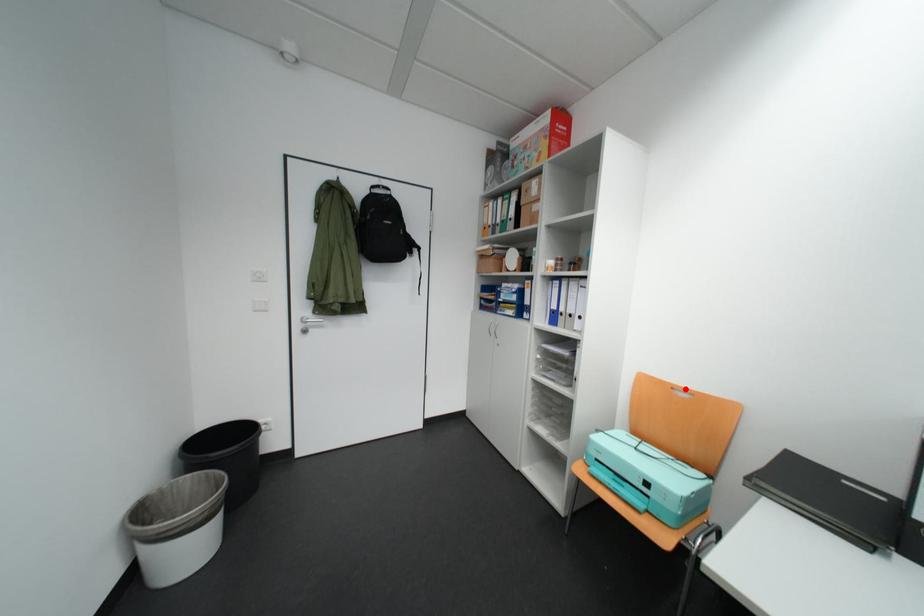
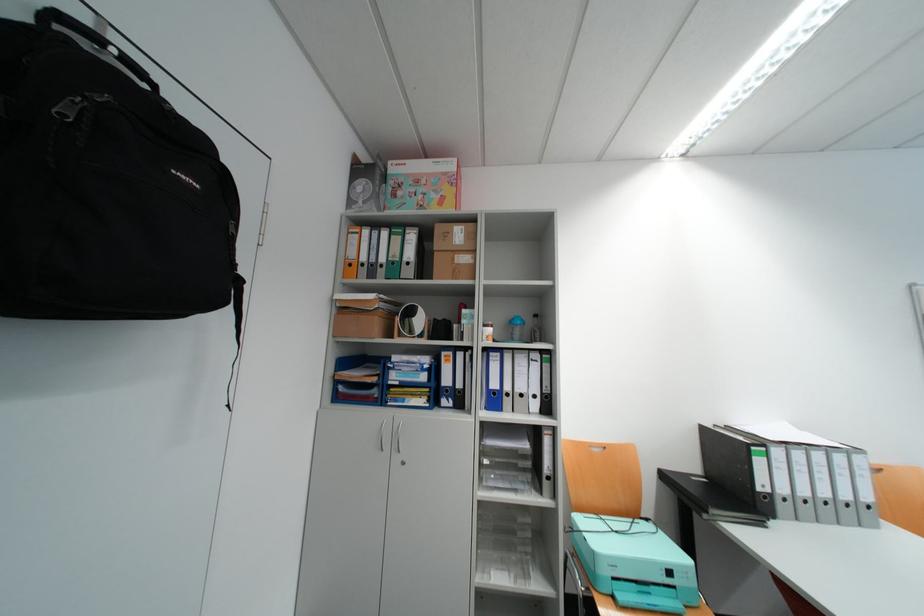
The point at the highlighted location is marked in the first image. Where is the corresponding point in the second image?

(602, 447)